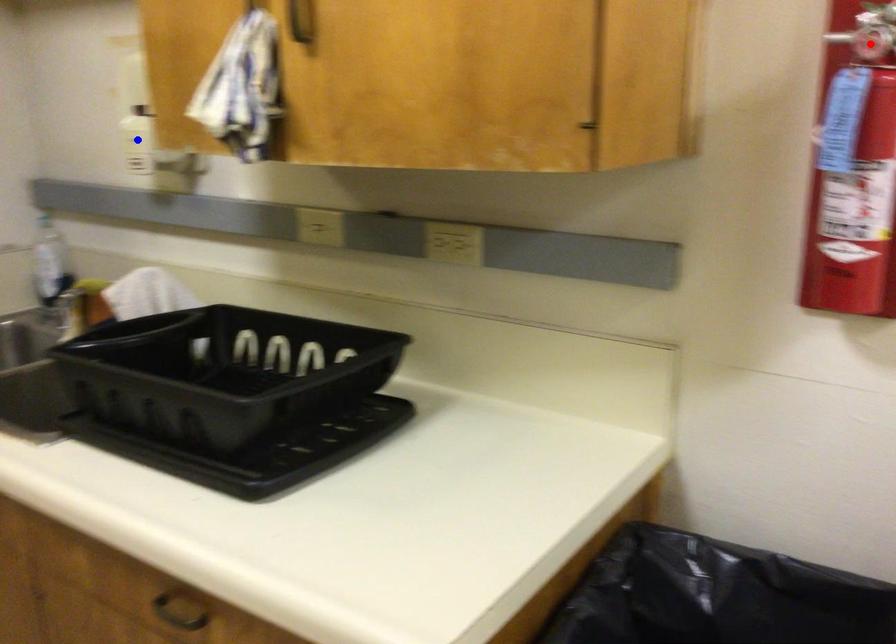
Question: Which of the two points in the image is closer to the camera?

Choices:
 (A) Blue point is closer.
 (B) Red point is closer.

Answer: (B)